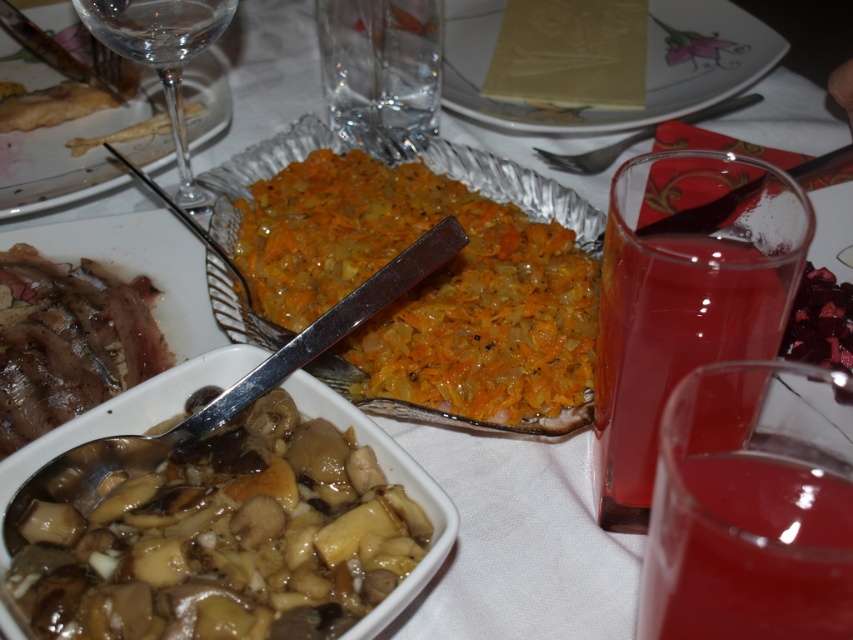
Question: Among these objects, which one is nearest to the camera?

Choices:
 (A) brown crispy bread at upper left
 (B) transparent glass wine glass at upper left
 (C) orange shredded vegetable at center

Answer: (C)

Question: Which point is closer to the camera?

Choices:
 (A) transparent glass wine glass at upper left
 (B) brown crispy bread at upper left

Answer: (A)

Question: Estimate the real-world distances between objects in this image. Which object is farther from the brown glossy mushrooms at lower left?

Choices:
 (A) translucent glass juice at lower right
 (B) dark red glossy berries at right
 (C) brown crispy bread at upper left
 (D) glossy brown mushrooms at lower left

Answer: (B)

Question: Can you confirm if transparent glass wine glass at upper left is positioned above shiny silver fork at upper left?

Choices:
 (A) no
 (B) yes

Answer: (A)

Question: Can you confirm if translucent glass juice at right is positioned below shiny silver fork at upper left?

Choices:
 (A) no
 (B) yes

Answer: (B)

Question: Is glossy brown mushrooms at lower left above white paper napkin at center?

Choices:
 (A) no
 (B) yes

Answer: (A)